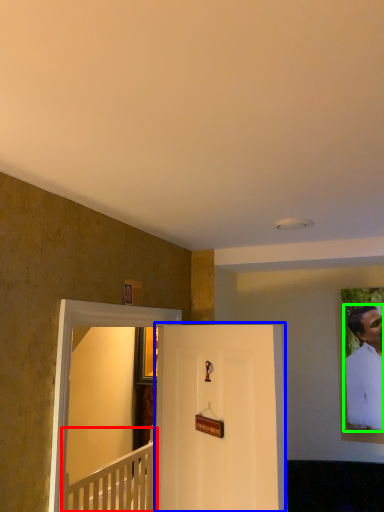
Question: Estimate the real-world distances between objects in this image. Which object is closer to furniture (highlighted by a red box), door (highlighted by a blue box) or man (highlighted by a green box)?

Choices:
 (A) door
 (B) man

Answer: (A)